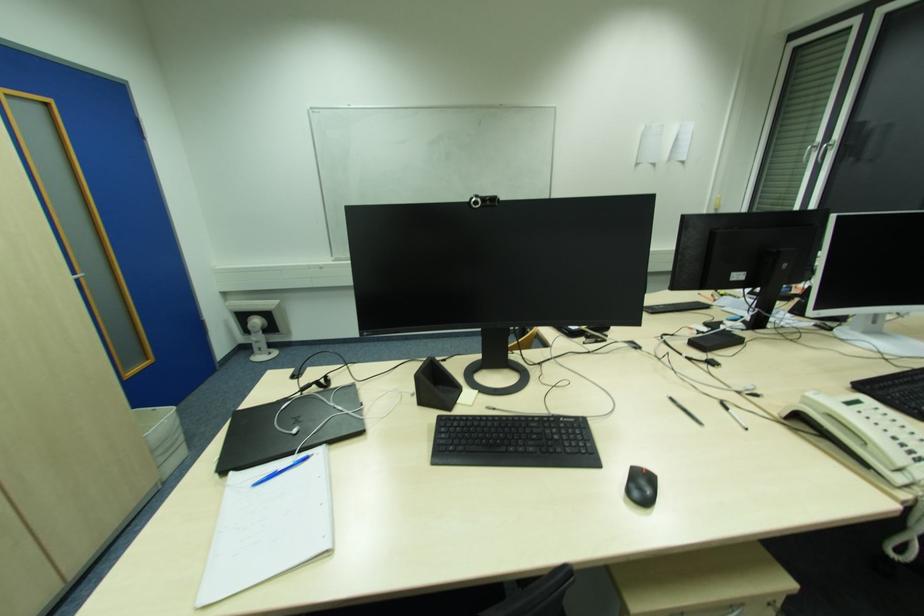
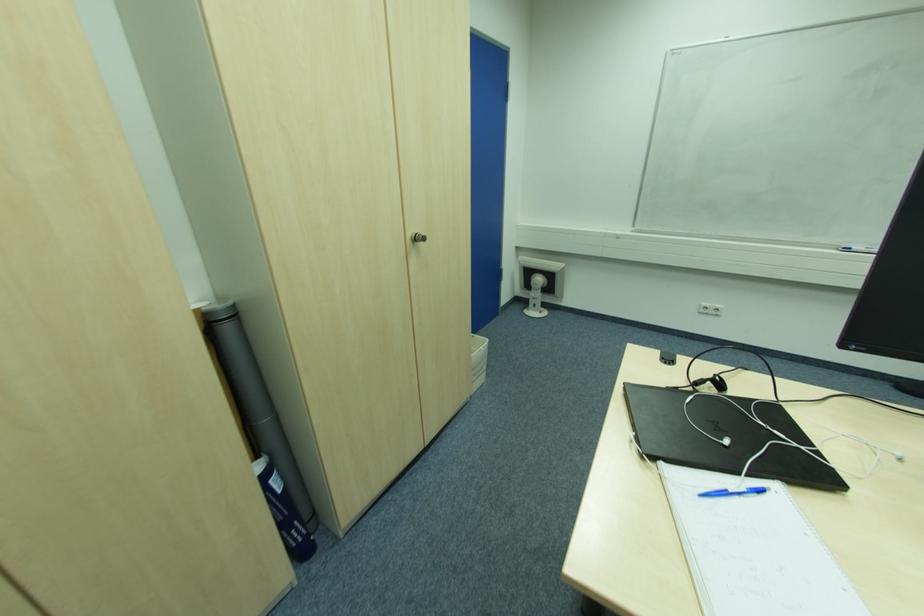
In the second image, find the point that corresponds to (x=233, y=474) in the first image.

(663, 464)